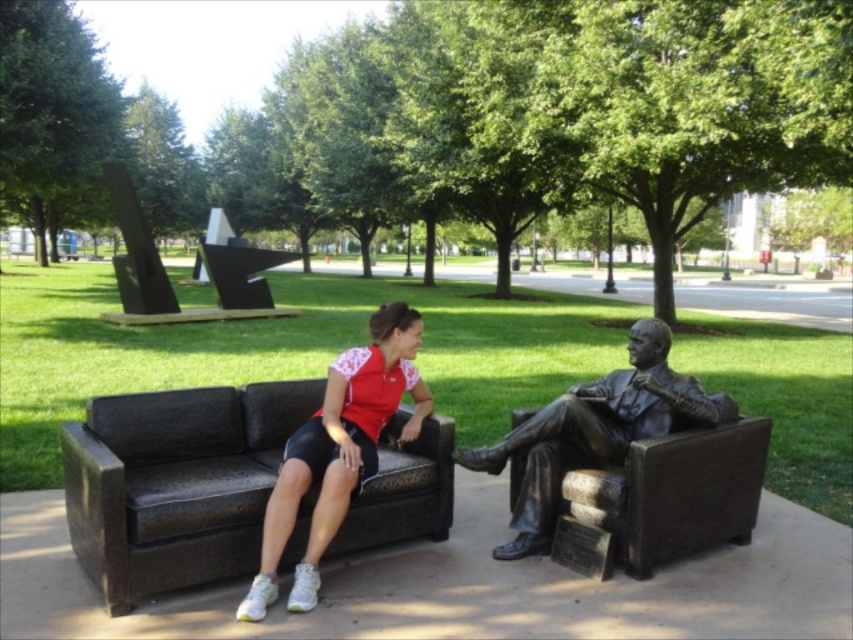
Does dark brown leather couch at center have a larger size compared to bronze statue at right?

Yes, dark brown leather couch at center is bigger than bronze statue at right.

Measure the distance between dark brown leather couch at center and camera.

dark brown leather couch at center and camera are 2.66 meters apart.

I want to click on dark brown leather couch at center, so click(x=175, y=483).

Where is `dark brown leather couch at center`? This screenshot has height=640, width=853. dark brown leather couch at center is located at coordinates (175, 483).

Between dark brown leather couch at center and bronze/statue at right, which one appears on the left side from the viewer's perspective?

dark brown leather couch at center

Does dark brown leather couch at center appear under bronze/statue at right?

No, dark brown leather couch at center is not below bronze/statue at right.

Which is behind, point (80, 452) or point (679, 486)?

Positioned behind is point (679, 486).

Identify the location of dark brown leather couch at center. The image size is (853, 640). (175, 483).

Is bronze/statue at right to the right of matte red shirt at center from the viewer's perspective?

Correct, you'll find bronze/statue at right to the right of matte red shirt at center.

Based on the photo, does bronze/statue at right have a smaller size compared to matte red shirt at center?

Correct, bronze/statue at right occupies less space than matte red shirt at center.

Which is behind, point (648, 541) or point (299, 486)?

Point (648, 541)

You are a GUI agent. You are given a task and a screenshot of the screen. Output one action in this format:
    pyautogui.click(x=<x>, y=<y>)
    Task: Click on the bronze/statue at right
    The height and width of the screenshot is (640, 853).
    Given the screenshot: What is the action you would take?
    pyautogui.click(x=662, y=499)